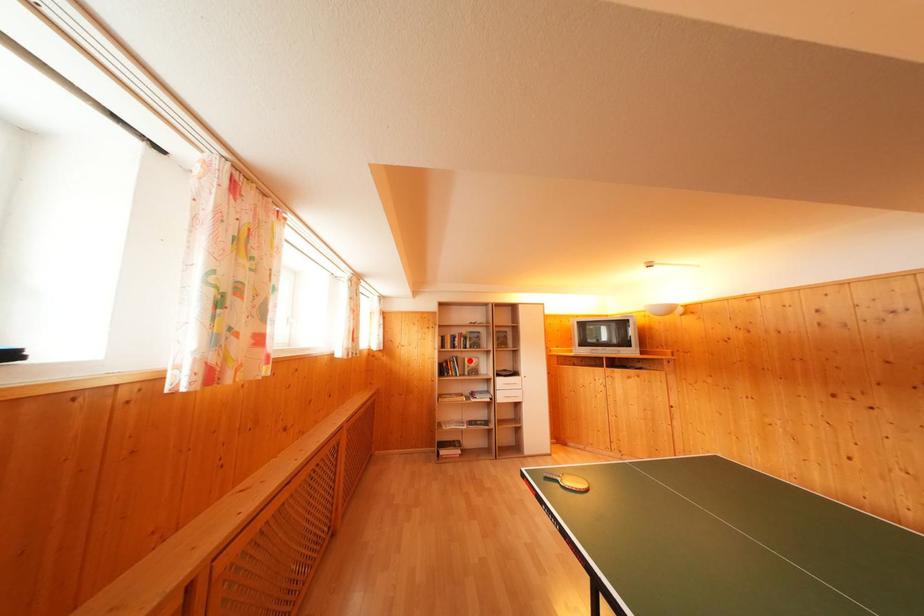
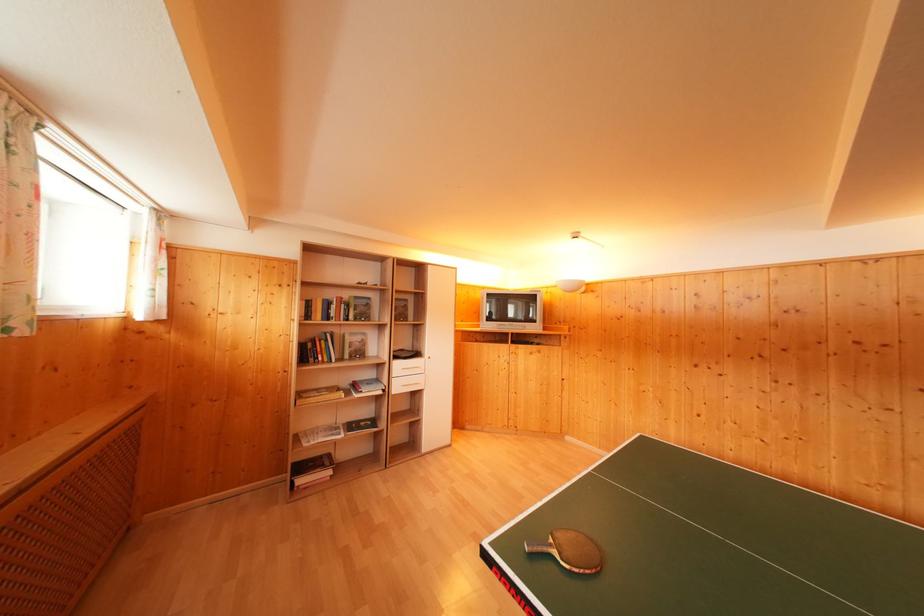
Find the pixel in the second image that matches the highlighted location in the first image.

(350, 336)